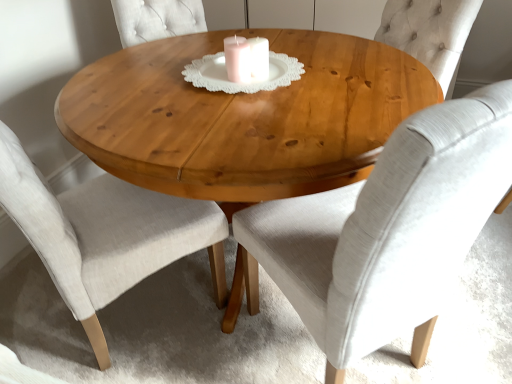
Locate an element on the screen. The image size is (512, 384). free spot above natural wood table at center (from a real-world perspective) is located at coordinates (207, 72).